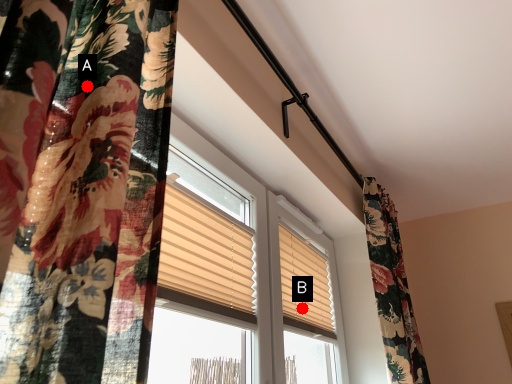
Question: Two points are circled on the image, labeled by A and B beside each circle. Which point is closer to the camera taking this photo?

Choices:
 (A) A is closer
 (B) B is closer

Answer: (A)